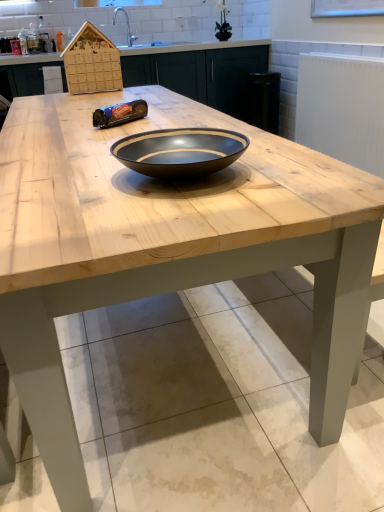
Question: In terms of size, does white textured radiator at upper right appear bigger or smaller than black glossy bowl at center?

Choices:
 (A) big
 (B) small

Answer: (A)

Question: Is white textured radiator at upper right taller or shorter than black glossy bowl at center?

Choices:
 (A) tall
 (B) short

Answer: (A)

Question: Which is nearer to the white textured radiator at upper right?

Choices:
 (A) black glossy bowl at center
 (B) wooden cabinetry at center

Answer: (B)

Question: Estimate the real-world distances between objects in this image. Which object is farther from the black glossy bowl at center?

Choices:
 (A) wooden cabinetry at center
 (B) white textured radiator at upper right

Answer: (A)